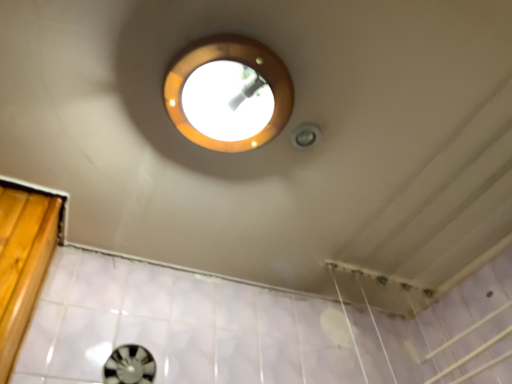
Looking at this image, what is the approximate height of matte gold light fixture at upper center?

It is 1.64 inches.

Where is `matte gold light fixture at upper center`? This screenshot has width=512, height=384. matte gold light fixture at upper center is located at coordinates (229, 93).

Describe the element at coordinates (229, 93) in the screenshot. This screenshot has height=384, width=512. I see `matte gold light fixture at upper center` at that location.

Image resolution: width=512 pixels, height=384 pixels. What do you see at coordinates (129, 365) in the screenshot?
I see `black plastic porthole at lower left` at bounding box center [129, 365].

Where is `black plastic porthole at lower left`? Image resolution: width=512 pixels, height=384 pixels. black plastic porthole at lower left is located at coordinates (129, 365).

Locate an element on the screen. Image resolution: width=512 pixels, height=384 pixels. matte gold light fixture at upper center is located at coordinates (x=229, y=93).

In the scene shown: Would you say black plastic porthole at lower left is to the left or to the right of matte gold light fixture at upper center in the picture?

Based on their positions, black plastic porthole at lower left is located to the left of matte gold light fixture at upper center.

From the picture: Between black plastic porthole at lower left and matte gold light fixture at upper center, which one is positioned behind?

black plastic porthole at lower left.

Does point (126, 347) come farther from viewer compared to point (179, 106)?

That is True.

From the image's perspective, between black plastic porthole at lower left and matte gold light fixture at upper center, which one is located above?

matte gold light fixture at upper center.

From a real-world perspective, is black plastic porthole at lower left positioned over matte gold light fixture at upper center based on gravity?

No, from a real-world perspective, black plastic porthole at lower left is not above matte gold light fixture at upper center.

Between black plastic porthole at lower left and matte gold light fixture at upper center, which one has larger width?

Wider between the two is matte gold light fixture at upper center.

Is black plastic porthole at lower left taller or shorter than matte gold light fixture at upper center?

Considering their sizes, black plastic porthole at lower left has more height than matte gold light fixture at upper center.

Looking at this image, considering the sizes of black plastic porthole at lower left and matte gold light fixture at upper center in the image, is black plastic porthole at lower left bigger or smaller than matte gold light fixture at upper center?

Clearly, black plastic porthole at lower left is smaller in size than matte gold light fixture at upper center.

Do you think black plastic porthole at lower left is within matte gold light fixture at upper center, or outside of it?

black plastic porthole at lower left is outside matte gold light fixture at upper center.

Is black plastic porthole at lower left next to matte gold light fixture at upper center?

They are not placed beside each other.

Is black plastic porthole at lower left positioned with its back to matte gold light fixture at upper center?

No, black plastic porthole at lower left's orientation is not away from matte gold light fixture at upper center.

Where is `porthole below the matte gold light fixture at upper center (from the image's perspective)`? This screenshot has width=512, height=384. porthole below the matte gold light fixture at upper center (from the image's perspective) is located at coordinates (129, 365).

Would you say matte gold light fixture at upper center is to the left or to the right of black plastic porthole at lower left in the picture?

In the image, matte gold light fixture at upper center appears on the right side of black plastic porthole at lower left.

Does matte gold light fixture at upper center lie behind black plastic porthole at lower left?

No, it is not.

Does point (249, 69) appear closer or farther from the camera than point (113, 351)?

Clearly, point (249, 69) is closer to the camera than point (113, 351).

From the image's perspective, is matte gold light fixture at upper center above or below black plastic porthole at lower left?

Clearly, from the image's perspective, matte gold light fixture at upper center is above black plastic porthole at lower left.

From a real-world perspective, is matte gold light fixture at upper center located higher than black plastic porthole at lower left?

Yes, from a real-world perspective, matte gold light fixture at upper center is over black plastic porthole at lower left

Does matte gold light fixture at upper center have a lesser width compared to black plastic porthole at lower left?

No.

Who is shorter, matte gold light fixture at upper center or black plastic porthole at lower left?

matte gold light fixture at upper center.

Can you confirm if matte gold light fixture at upper center is smaller than black plastic porthole at lower left?

Incorrect, matte gold light fixture at upper center is not smaller in size than black plastic porthole at lower left.

Is matte gold light fixture at upper center inside or outside of black plastic porthole at lower left?

matte gold light fixture at upper center is spatially situated outside black plastic porthole at lower left.

Is matte gold light fixture at upper center far from black plastic porthole at lower left?

No, matte gold light fixture at upper center is not far from black plastic porthole at lower left.

Is matte gold light fixture at upper center facing towards black plastic porthole at lower left?

No, matte gold light fixture at upper center is not aimed at black plastic porthole at lower left.

How many degrees apart are the facing directions of matte gold light fixture at upper center and black plastic porthole at lower left?

The angle between the facing direction of matte gold light fixture at upper center and the facing direction of black plastic porthole at lower left is 4.52 degrees.

Locate an element on the screen. Image resolution: width=512 pixels, height=384 pixels. porthole below the matte gold light fixture at upper center (from the image's perspective) is located at coordinates (129, 365).

Locate an element on the screen. The height and width of the screenshot is (384, 512). light to the right of black plastic porthole at lower left is located at coordinates [x=229, y=93].

Find the location of `light in front of the black plastic porthole at lower left`. light in front of the black plastic porthole at lower left is located at coordinates (229, 93).